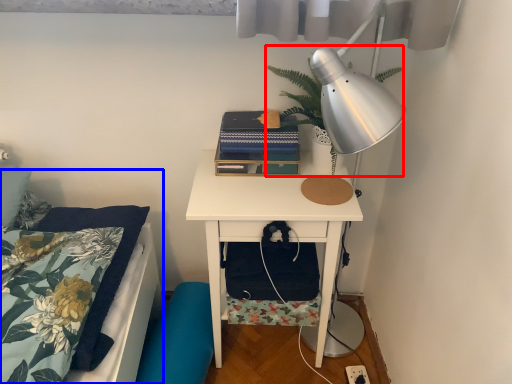
Question: Among these objects, which one is nearest to the camera, plant (highlighted by a red box) or bed (highlighted by a blue box)?

Choices:
 (A) plant
 (B) bed

Answer: (B)